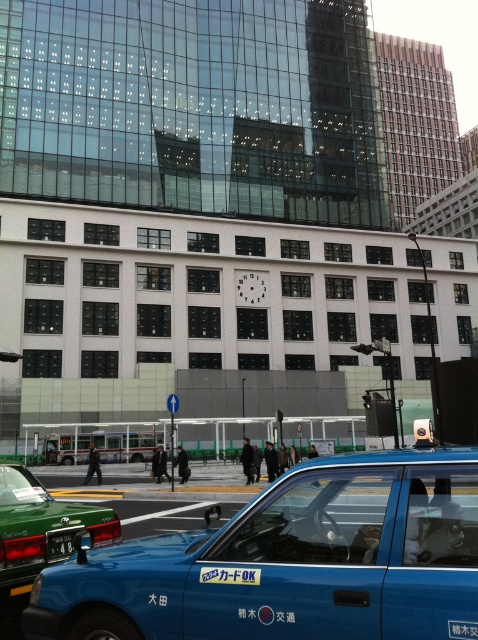
Where is `green matte taxi at lower left`? This screenshot has height=640, width=478. green matte taxi at lower left is located at coordinates (41, 529).

In the scene shown: Can you confirm if green matte taxi at lower left is positioned below green matte license plate at lower left?

Incorrect, green matte taxi at lower left is not positioned below green matte license plate at lower left.

Image resolution: width=478 pixels, height=640 pixels. Identify the location of green matte taxi at lower left. point(41,529).

Looking at this image, does blue matte taxi at lower center come behind green matte taxi at lower left?

No, blue matte taxi at lower center is closer to the viewer.

Which is above, blue matte taxi at lower center or green matte taxi at lower left?

blue matte taxi at lower center is above.

Is point (250, 598) closer to camera compared to point (65, 502)?

Yes, it is in front of point (65, 502).

The image size is (478, 640). I want to click on blue matte taxi at lower center, so [292, 563].

Is point (467, 516) closer to viewer compared to point (50, 561)?

Yes, it is.

Is point (312, 588) behind point (65, 544)?

No, it is in front of (65, 544).

The width and height of the screenshot is (478, 640). What do you see at coordinates (292, 563) in the screenshot? I see `blue matte taxi at lower center` at bounding box center [292, 563].

Locate an element on the screen. Image resolution: width=478 pixels, height=640 pixels. blue matte taxi at lower center is located at coordinates (292, 563).